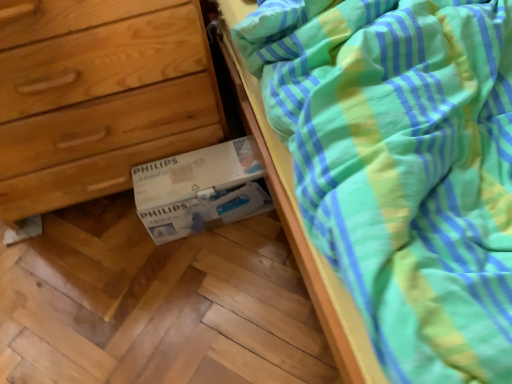
The image size is (512, 384). What are the coordinates of `blank space situated above white cardboard box at lower center (from a real-world perspective)` in the screenshot? It's located at (187, 172).